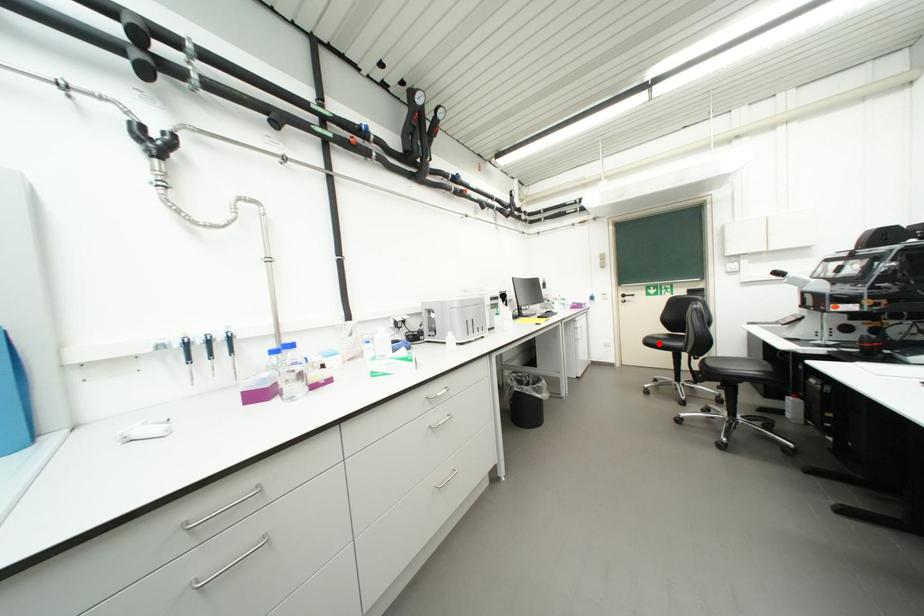
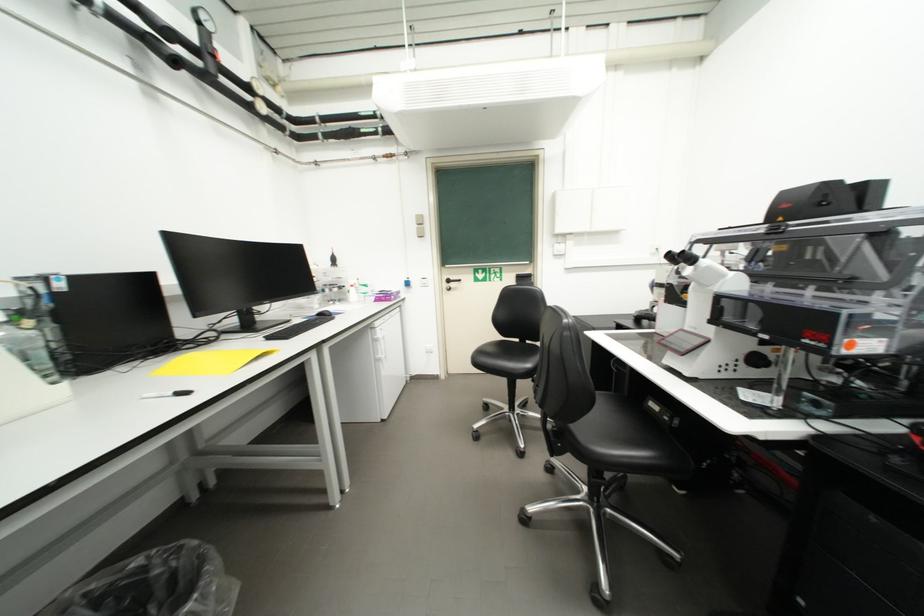
Where in the second image is the point corresponding to the highlighted location from the first image?

(490, 362)